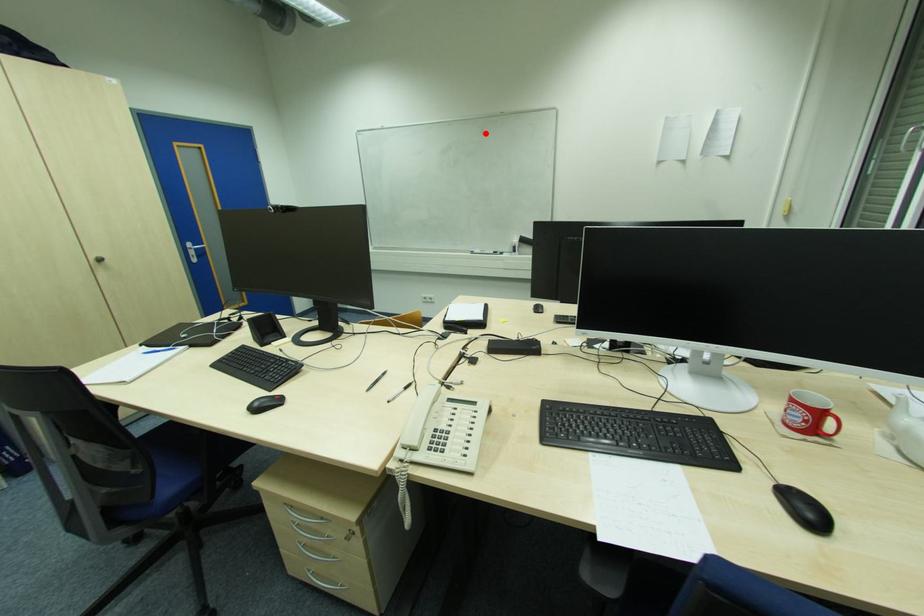
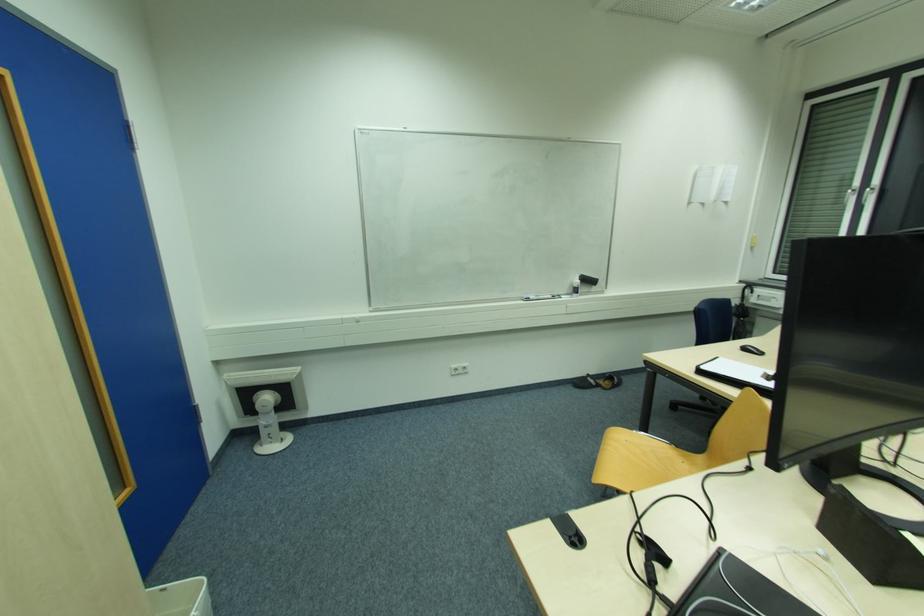
Locate, in the second image, the point that corresponds to the highlighted location in the first image.

(550, 158)